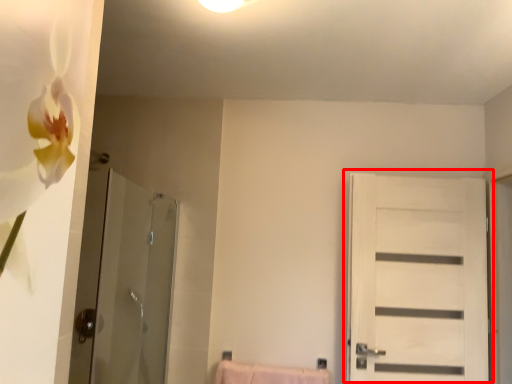
Question: From the image's perspective, where is door (annotated by the red box) located in relation to screen door in the image?

Choices:
 (A) below
 (B) above

Answer: (A)